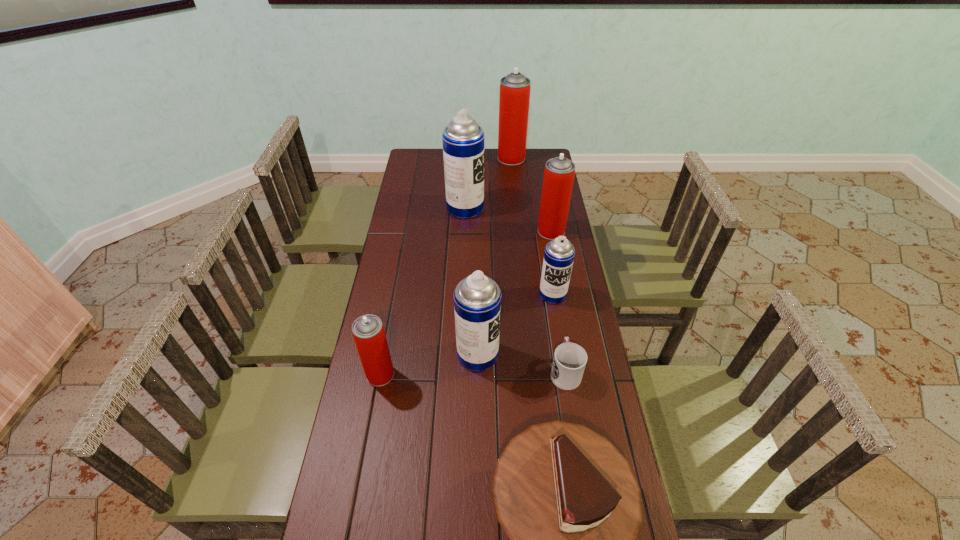
The height and width of the screenshot is (540, 960). I want to click on vacant space situated on the side of the cup where the handle is located, so click(558, 323).

At what (x,y) coordinates should I click in order to perform the action: click on vacant space situated 0.170m on the side of the cup where the handle is located. Please return your answer as a coordinate pair (x, y). Looking at the image, I should click on (556, 313).

You are a GUI agent. You are given a task and a screenshot of the screen. Output one action in this format:
    pyautogui.click(x=<x>, y=<y>)
    Task: Click on the object that is at the far edge
    This screenshot has height=540, width=960.
    Given the screenshot: What is the action you would take?
    pyautogui.click(x=514, y=98)

Locate an element on the screen. The width and height of the screenshot is (960, 540). object situated at the left edge is located at coordinates (368, 332).

At what (x,y) coordinates should I click in order to perform the action: click on cup present at the right edge. Please return your answer as a coordinate pair (x, y). The width and height of the screenshot is (960, 540). Looking at the image, I should click on (569, 362).

The width and height of the screenshot is (960, 540). What are the coordinates of `object that is at the far right corner` in the screenshot? It's located at [x=514, y=98].

In the image, there is a desktop. Where is `free region at the left edge`? free region at the left edge is located at coordinates (412, 320).

This screenshot has width=960, height=540. In the image, there is a desktop. What are the coordinates of `free space at the right edge` in the screenshot? It's located at (545, 353).

This screenshot has height=540, width=960. I want to click on blank area at the far left corner, so click(431, 158).

At what (x,y) coordinates should I click in order to perform the action: click on free space between the nearest blue aerosol can and the red cup. Please return your answer as a coordinate pair (x, y). Looking at the image, I should click on (521, 362).